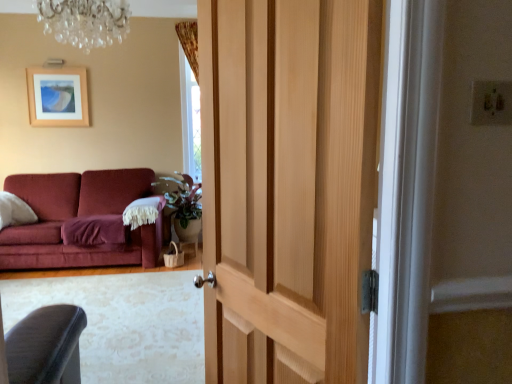
Question: From the image's perspective, does natural wood door at center appear higher than fuzzy woolen blanket at left?

Choices:
 (A) yes
 (B) no

Answer: (A)

Question: From a real-world perspective, is natural wood door at center positioned under fuzzy woolen blanket at left based on gravity?

Choices:
 (A) no
 (B) yes

Answer: (A)

Question: Is natural wood door at center oriented towards fuzzy woolen blanket at left?

Choices:
 (A) yes
 (B) no

Answer: (B)

Question: Considering the relative positions of natural wood door at center and fuzzy woolen blanket at left in the image provided, is natural wood door at center behind fuzzy woolen blanket at left?

Choices:
 (A) no
 (B) yes

Answer: (A)

Question: From the image's perspective, would you say natural wood door at center is shown under fuzzy woolen blanket at left?

Choices:
 (A) yes
 (B) no

Answer: (B)

Question: Looking at the image, does natural wood door at center seem bigger or smaller compared to crystal glass chandelier at upper center?

Choices:
 (A) small
 (B) big

Answer: (B)

Question: In the image, is natural wood door at center on the left side or the right side of crystal glass chandelier at upper center?

Choices:
 (A) right
 (B) left

Answer: (A)

Question: Considering the positions of point coord(208,253) and point coord(55,6), is point coord(208,253) closer or farther from the camera than point coord(55,6)?

Choices:
 (A) farther
 (B) closer

Answer: (B)

Question: From a real-world perspective, relative to crystal glass chandelier at upper center, is natural wood door at center vertically above or below?

Choices:
 (A) below
 (B) above

Answer: (A)

Question: Based on their sizes in the image, would you say fuzzy woolen blanket at left is bigger or smaller than natural wood door at center?

Choices:
 (A) small
 (B) big

Answer: (A)

Question: From the image's perspective, is fuzzy woolen blanket at left above or below natural wood door at center?

Choices:
 (A) above
 (B) below

Answer: (B)

Question: Based on their positions, is fuzzy woolen blanket at left located to the left or right of natural wood door at center?

Choices:
 (A) left
 (B) right

Answer: (A)

Question: From their relative heights in the image, would you say fuzzy woolen blanket at left is taller or shorter than natural wood door at center?

Choices:
 (A) tall
 (B) short

Answer: (B)

Question: From a real-world perspective, is crystal glass chandelier at upper center physically located above or below natural wood door at center?

Choices:
 (A) below
 (B) above

Answer: (B)

Question: Considering the positions of crystal glass chandelier at upper center and natural wood door at center in the image, is crystal glass chandelier at upper center bigger or smaller than natural wood door at center?

Choices:
 (A) small
 (B) big

Answer: (A)